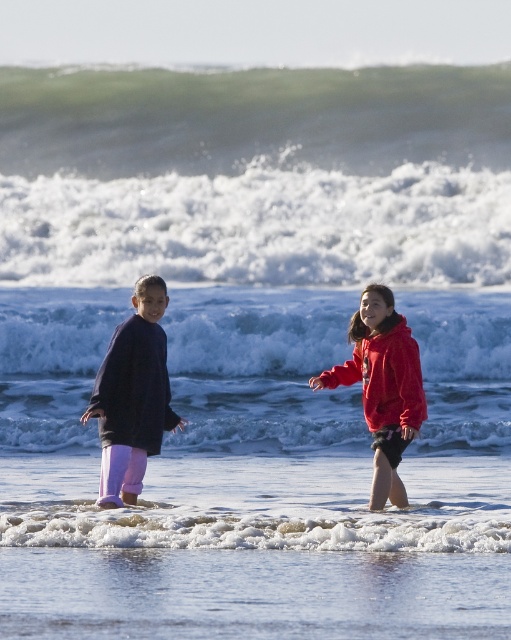
Question: Is matte purple pants at left thinner than red fleece jacket at center?

Choices:
 (A) no
 (B) yes

Answer: (B)

Question: Which point appears farthest from the camera in this image?

Choices:
 (A) (386, 342)
 (B) (319, 378)
 (C) (263, 518)
 (D) (185, 422)

Answer: (D)

Question: Which of the following is the closest to the observer?

Choices:
 (A) white frothy wave at center
 (B) white foamy wave at lower center
 (C) matte black hand at center

Answer: (B)

Question: Can you confirm if white foamy wave at upper center is bigger than matte purple pants at left?

Choices:
 (A) yes
 (B) no

Answer: (A)

Question: Can you confirm if green frothy wave at upper center is positioned above smooth red hand at center?

Choices:
 (A) no
 (B) yes

Answer: (B)

Question: Based on their relative distances, which object is nearer to the green frothy wave at upper center?

Choices:
 (A) matte purple pants at left
 (B) white foamy wave at upper center

Answer: (B)